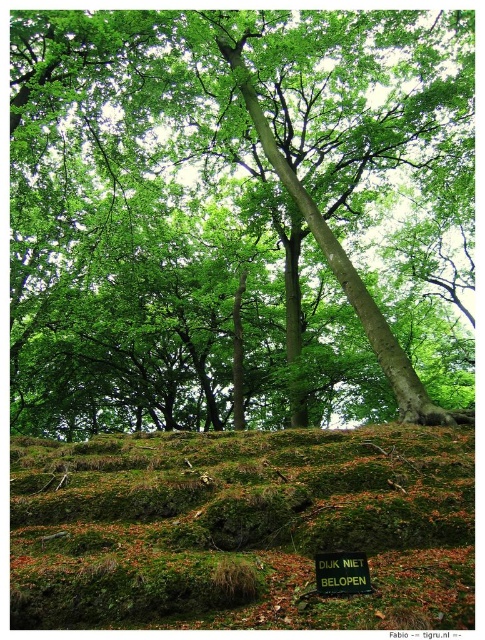
You are standing in the forest and want to walk towards the green mossy hillside at lower center. Which direction should you move relative to the green leafy tree at center?

You should move to the left of the green leafy tree at center to reach the green mossy hillside at lower center because the green leafy tree at center is to the right of the green mossy hillside at lower center.

You are a hiker standing at the base of the green mossy hillside at lower center. Looking up, can you see the green leafy tree at center from your current position?

Yes, the green leafy tree at center is above the green mossy hillside at lower center, so you can see it from your current position.